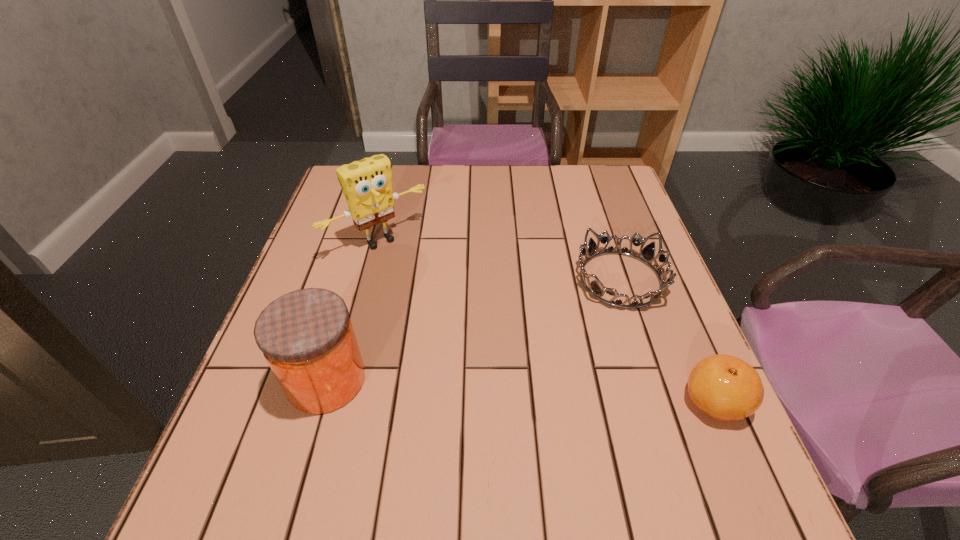
Image resolution: width=960 pixels, height=540 pixels. I want to click on the third shortest object, so tap(306, 336).

Where is `clementine`? clementine is located at coordinates (726, 388).

Where is `tiara`? The width and height of the screenshot is (960, 540). tiara is located at coordinates (647, 254).

You are a GUI agent. You are given a task and a screenshot of the screen. Output one action in this format:
    pyautogui.click(x=<x>, y=<y>)
    Task: Click on the tallest object
    The height and width of the screenshot is (540, 960).
    Given the screenshot: What is the action you would take?
    pyautogui.click(x=367, y=185)

In order to click on free space located on the right of the third shortest object in this screenshot , I will do `click(540, 380)`.

I want to click on vacant space located on the left of the clementine, so click(538, 401).

The width and height of the screenshot is (960, 540). I want to click on free point located on the front-facing side of the tiara, so click(557, 323).

I want to click on free spot located on the front-facing side of the tiara, so point(447,396).

Image resolution: width=960 pixels, height=540 pixels. I want to click on free space located on the front-facing side of the tiara, so click(x=481, y=374).

Find the location of a particular element. free location located on the face of the sponge is located at coordinates (421, 280).